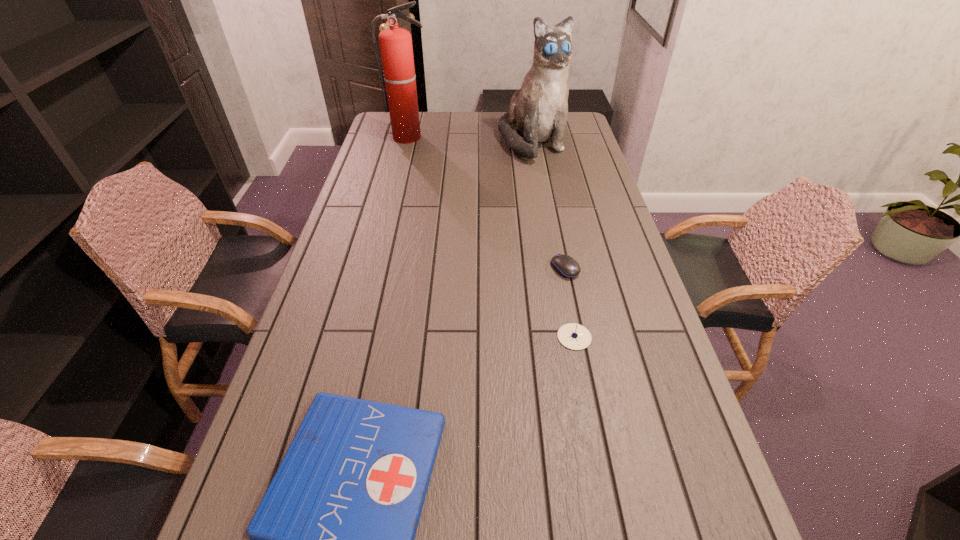
At what (x,y) coordinates should I click in order to perform the action: click on fire extinguisher. Please return your answer as a coordinate pair (x, y). Looking at the image, I should click on (399, 75).

Find the location of `cat`. cat is located at coordinates (538, 112).

Locate an element on the screen. This screenshot has width=960, height=540. the fourth farthest object is located at coordinates (573, 336).

Where is `compass`? This screenshot has height=540, width=960. compass is located at coordinates (573, 336).

This screenshot has width=960, height=540. I want to click on computer mouse, so click(566, 266).

Find the location of a particular element. This screenshot has height=540, width=960. free space located 0.080m with the nozzle and gauge on the fire extinguisher is located at coordinates (404, 153).

This screenshot has width=960, height=540. Find the location of `blank space located at the face of the cat`. blank space located at the face of the cat is located at coordinates coord(547,225).

Where is `blank area located on the front of the third shortest object`? The image size is (960, 540). blank area located on the front of the third shortest object is located at coordinates (600, 468).

I want to click on vacant space located 0.120m on the left of the computer mouse, so click(x=512, y=268).

The image size is (960, 540). What are the coordinates of `fire extinguisher that is at the far edge` in the screenshot? It's located at (399, 75).